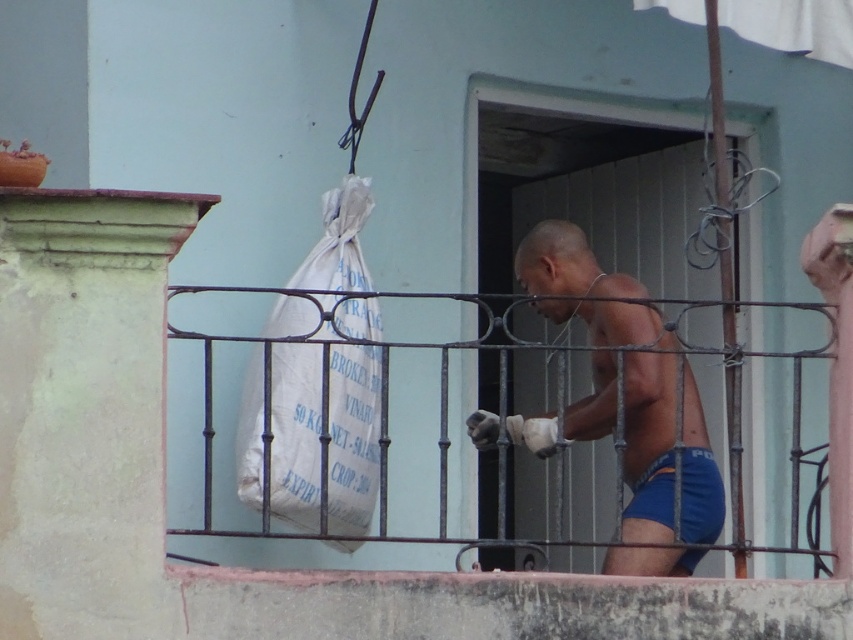
Does blue fabric shorts at center have a smaller size compared to white fabric sack at center?

No, blue fabric shorts at center is not smaller than white fabric sack at center.

Can you confirm if blue fabric shorts at center is positioned below white fabric sack at center?

Yes, blue fabric shorts at center is below white fabric sack at center.

Between point (589, 282) and point (367, 518), which one is positioned behind?

Point (589, 282)

I want to click on blue fabric shorts at center, so click(648, 444).

What do you see at coordinates (352, 436) in the screenshot?
I see `white fabric sack at center` at bounding box center [352, 436].

Does point (312, 497) come in front of point (738, 532)?

No, (312, 497) is further to viewer.

Measure the distance between white fabric sack at center and camera.

white fabric sack at center and camera are 15.27 meters apart.

Where is `white fabric sack at center`? white fabric sack at center is located at coordinates 352,436.

Can you confirm if blue fabric shorts at center is shorter than blue fabric shorts at lower right?

No, blue fabric shorts at center is not shorter than blue fabric shorts at lower right.

What do you see at coordinates (648, 444) in the screenshot? I see `blue fabric shorts at center` at bounding box center [648, 444].

Which is in front, point (579, 257) or point (693, 548)?

Positioned in front is point (693, 548).

At what (x,y) coordinates should I click in order to perform the action: click on blue fabric shorts at center. Please return your answer as a coordinate pair (x, y). Looking at the image, I should click on (648, 444).